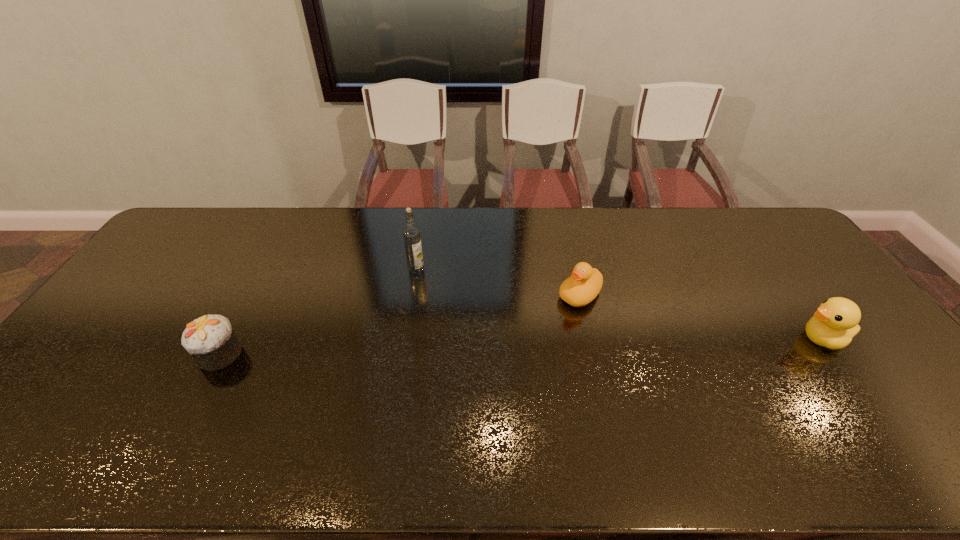
The image size is (960, 540). What are the coordinates of `vacant area that lies between the vodka and the farther duck` in the screenshot? It's located at (498, 283).

Find the location of `vacant space in between the rightmost object and the leftmost object`. vacant space in between the rightmost object and the leftmost object is located at coordinates (521, 346).

The image size is (960, 540). Identify the location of empty space between the second farthest object and the leftmost object. (400, 325).

Identify which object is the closest to the third object from right to left. Please provide its 2D coordinates. Your answer should be formatted as a tuple, i.e. [(x, y)], where the tuple contains the x and y coordinates of a point satisfying the conditions above.

[(585, 283)]

Where is `the closest object to the right duck`? The height and width of the screenshot is (540, 960). the closest object to the right duck is located at coordinates (585, 283).

You are a GUI agent. You are given a task and a screenshot of the screen. Output one action in this format:
    pyautogui.click(x=<x>, y=<y>)
    Task: Click on the vacant area in the image that satisfies the following two spatial constraints: 1. on the front side of the vodka; 2. on the face of the nearer duck
    
    Given the screenshot: What is the action you would take?
    pyautogui.click(x=405, y=339)

This screenshot has width=960, height=540. In order to click on vacant area in the image that satisfies the following two spatial constraints: 1. on the front side of the rightmost object; 2. on the face of the farthest object in this screenshot , I will do `click(405, 339)`.

The height and width of the screenshot is (540, 960). I want to click on vacant space that satisfies the following two spatial constraints: 1. on the front side of the right duck; 2. on the face of the left duck, so click(590, 339).

The height and width of the screenshot is (540, 960). Identify the location of vacant point that satisfies the following two spatial constraints: 1. on the front side of the third object from right to left; 2. on the face of the right duck. (405, 339).

Where is `vacant space that satisfies the following two spatial constraints: 1. on the front side of the third nearest object; 2. on the face of the rightmost object`? This screenshot has height=540, width=960. vacant space that satisfies the following two spatial constraints: 1. on the front side of the third nearest object; 2. on the face of the rightmost object is located at coordinates (590, 339).